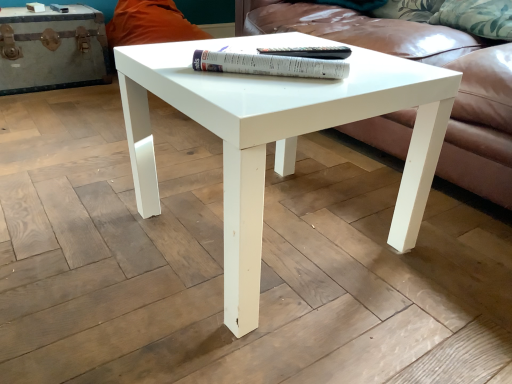
Question: Can you confirm if white paper at center, which ranks as the 1th paperback book in front-to-back order, is positioned to the left of white leather chest at left?

Choices:
 (A) no
 (B) yes

Answer: (A)

Question: Could you tell me if white paper at center, the second paperback book when ordered from back to front, is facing white leather chest at left?

Choices:
 (A) yes
 (B) no

Answer: (B)

Question: Is white paper at center, the second paperback book when ordered from back to front, thinner than white leather chest at left?

Choices:
 (A) yes
 (B) no

Answer: (A)

Question: Is white paper at center, which ranks as the 1th paperback book in front-to-back order, positioned before white leather chest at left?

Choices:
 (A) yes
 (B) no

Answer: (A)

Question: Does white paper at center, which ranks as the 1th paperback book in front-to-back order, lie behind white leather chest at left?

Choices:
 (A) no
 (B) yes

Answer: (A)

Question: Is white paper at center, the second paperback book when ordered from back to front, bigger than white leather chest at left?

Choices:
 (A) no
 (B) yes

Answer: (A)

Question: Is white leather chest at left located outside white glossy coffee table at center?

Choices:
 (A) yes
 (B) no

Answer: (A)

Question: Is white leather chest at left behind white glossy coffee table at center?

Choices:
 (A) no
 (B) yes

Answer: (B)

Question: From the image's perspective, does white leather chest at left appear lower than white glossy coffee table at center?

Choices:
 (A) yes
 (B) no

Answer: (B)

Question: Are white leather chest at left and white glossy coffee table at center far apart?

Choices:
 (A) no
 (B) yes

Answer: (B)

Question: Is white leather chest at left placed right next to white glossy coffee table at center?

Choices:
 (A) no
 (B) yes

Answer: (A)

Question: From a real-world perspective, is white leather chest at left located higher than white glossy coffee table at center?

Choices:
 (A) no
 (B) yes

Answer: (A)

Question: Is white leather chest at left to the left of white paper at center, the second paperback book when ordered from back to front, from the viewer's perspective?

Choices:
 (A) no
 (B) yes

Answer: (B)